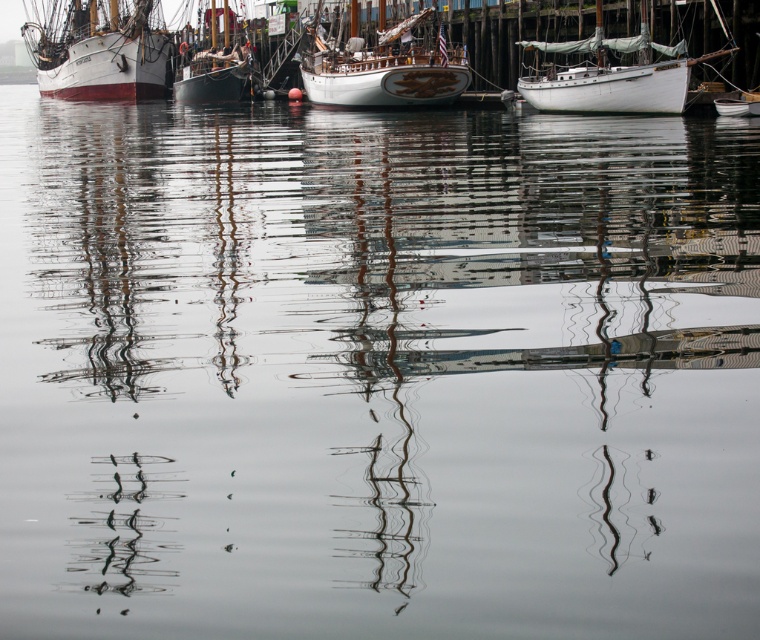
Who is higher up, white wooden ship at left or white matte sailboat at upper right?

white wooden ship at left is higher up.

Looking at this image, who is positioned more to the right, white wooden ship at left or white matte sailboat at upper right?

white matte sailboat at upper right

Who is more forward, (135, 10) or (603, 74)?

Point (603, 74) is more forward.

Locate an element on the screen. white wooden ship at left is located at coordinates (97, 48).

Does white wooden ship at left have a larger size compared to wooden sailboat at center?

Yes, white wooden ship at left is bigger than wooden sailboat at center.

Between white wooden ship at left and wooden sailboat at center, which one has less height?

wooden sailboat at center

Identify the location of white wooden ship at left. (97, 48).

Find the location of a particular element. white wooden ship at left is located at coordinates (97, 48).

Is white matte sailboat at upper right to the right of white polished wood boat at center from the viewer's perspective?

Yes, white matte sailboat at upper right is to the right of white polished wood boat at center.

Does white matte sailboat at upper right have a greater width compared to white polished wood boat at center?

Answer: No, white matte sailboat at upper right is not wider than white polished wood boat at center.

Find the location of a particular element. The image size is (760, 640). white matte sailboat at upper right is located at coordinates (613, 76).

This screenshot has width=760, height=640. I want to click on white matte sailboat at upper right, so click(x=613, y=76).